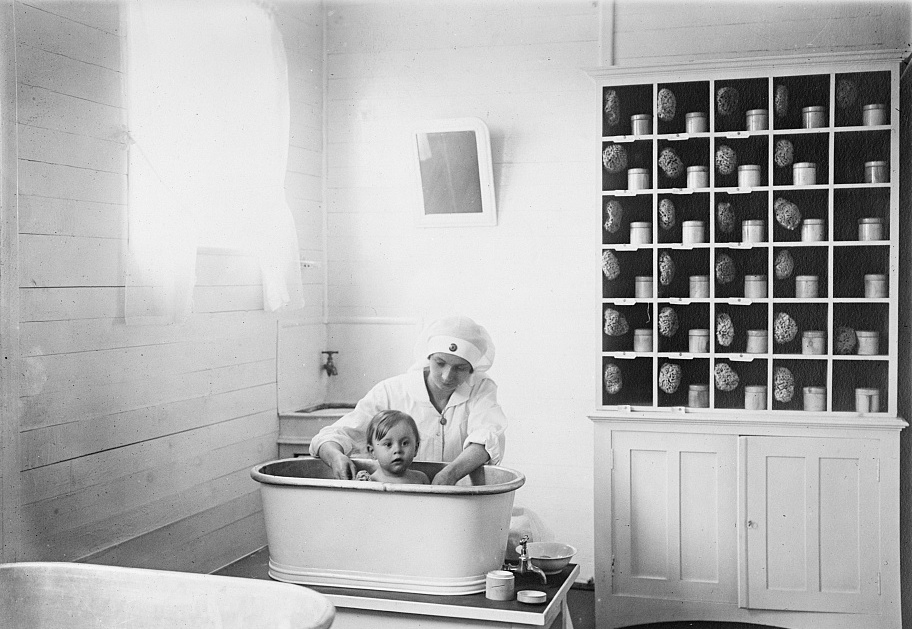
This screenshot has width=912, height=629. I want to click on tub, so point(391,536), point(161,585).